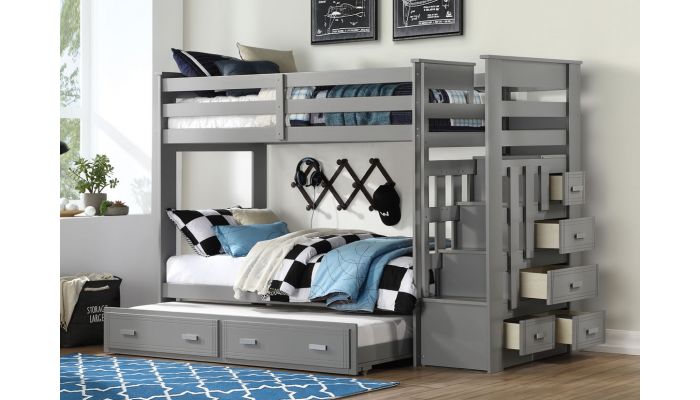
The width and height of the screenshot is (700, 400). Find the location of `bed`. bed is located at coordinates (332, 251).